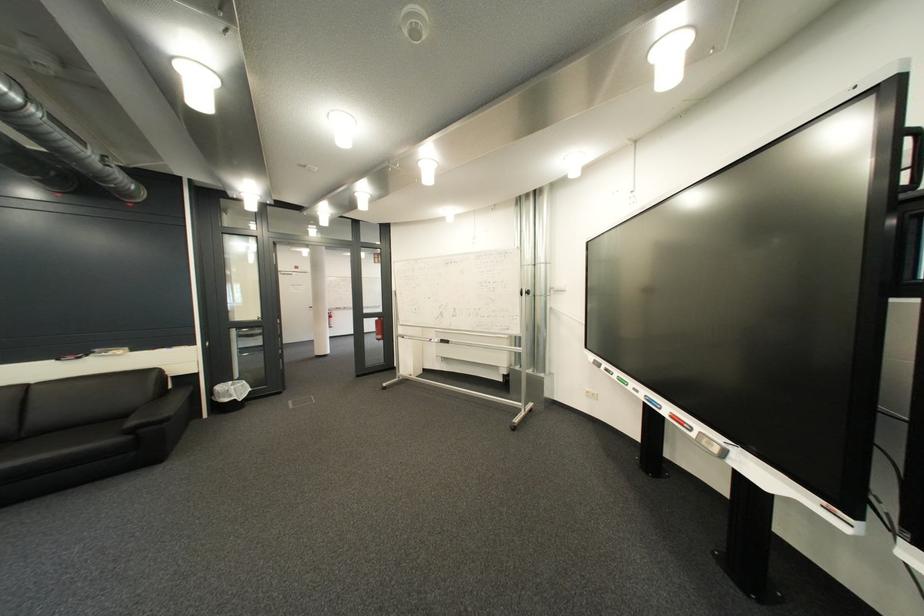
Where would you push the red display button? Please return your answer as a coordinate pair (x, y).

(679, 422)